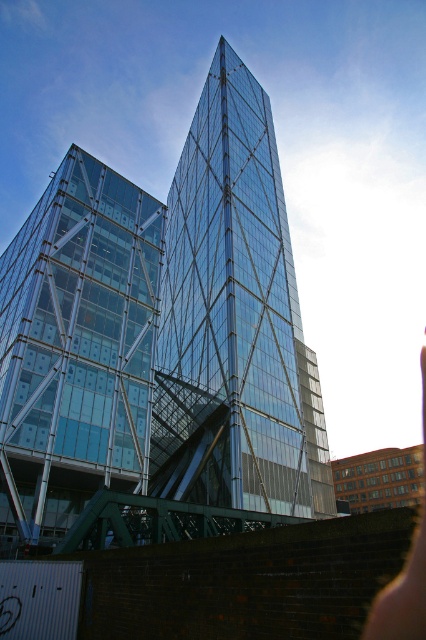
You are standing at the base of the skyscraper and want to take a photo of the triangular peak. The camera you have can focus on objects up to 150 feet away. Is the point at coordinates point [85,403] within the camera range?

The point at point [85,403] is 138.36 feet away from the viewer, which is within the camera range of 150 feet. Yes, the camera can focus on it.

Looking at this image, you are an architect evaluating the building design. You notice the transparent glass tower at center and the pink skin at lower right. Which one has a greater height?

The transparent glass tower at center is much taller than the pink skin at lower right, so it has a greater height.

Based on the scene description, can you determine the coordinates of the transparent glass building at left?

The transparent glass building at left is located at coordinates point (77,348).